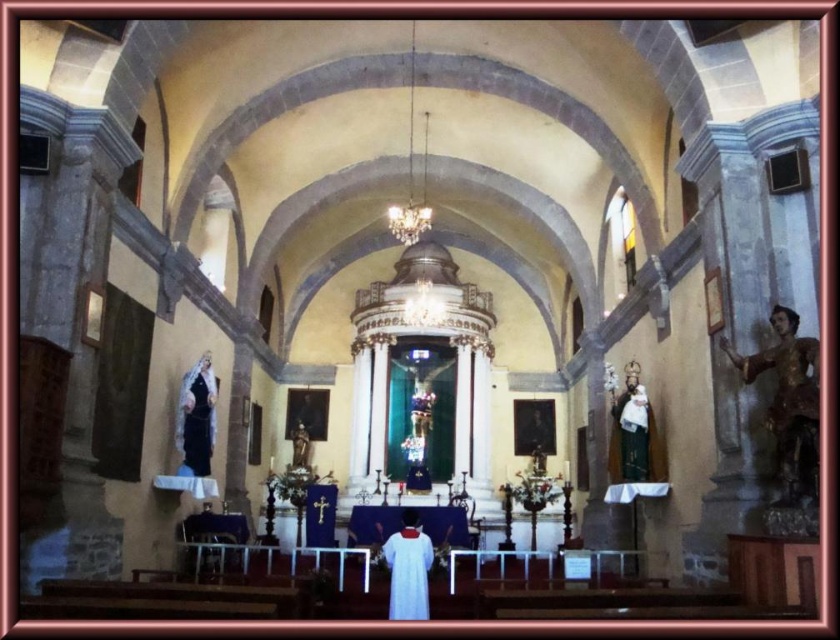
The height and width of the screenshot is (640, 840). Identify the location of wooden statue at right. (789, 403).

Image resolution: width=840 pixels, height=640 pixels. What do you see at coordinates (789, 403) in the screenshot? I see `wooden statue at right` at bounding box center [789, 403].

This screenshot has height=640, width=840. What are the coordinates of `wooden statue at right` in the screenshot? It's located at (789, 403).

Can you confirm if white cloth at center is shorter than matte white statue at left?

Indeed, white cloth at center has a lesser height compared to matte white statue at left.

You are a GUI agent. You are given a task and a screenshot of the screen. Output one action in this format:
    pyautogui.click(x=<x>, y=<y>)
    Task: Click on the white cloth at center
    The height and width of the screenshot is (640, 840).
    Given the screenshot: What is the action you would take?
    pyautogui.click(x=408, y=568)

Does point (420, 566) come behind point (192, 387)?

No, (420, 566) is closer to viewer.

At what (x,y) coordinates should I click in order to perform the action: click on white cloth at center. Please return your answer as a coordinate pair (x, y). The height and width of the screenshot is (640, 840). Looking at the image, I should click on (408, 568).

Can you confirm if green velvet statue at right is wider than matte white statue at left?

In fact, green velvet statue at right might be narrower than matte white statue at left.

Between green velvet statue at right and matte white statue at left, which one appears on the right side from the viewer's perspective?

Positioned to the right is green velvet statue at right.

Describe the element at coordinates (634, 435) in the screenshot. I see `green velvet statue at right` at that location.

Identify the location of green velvet statue at right. (634, 435).